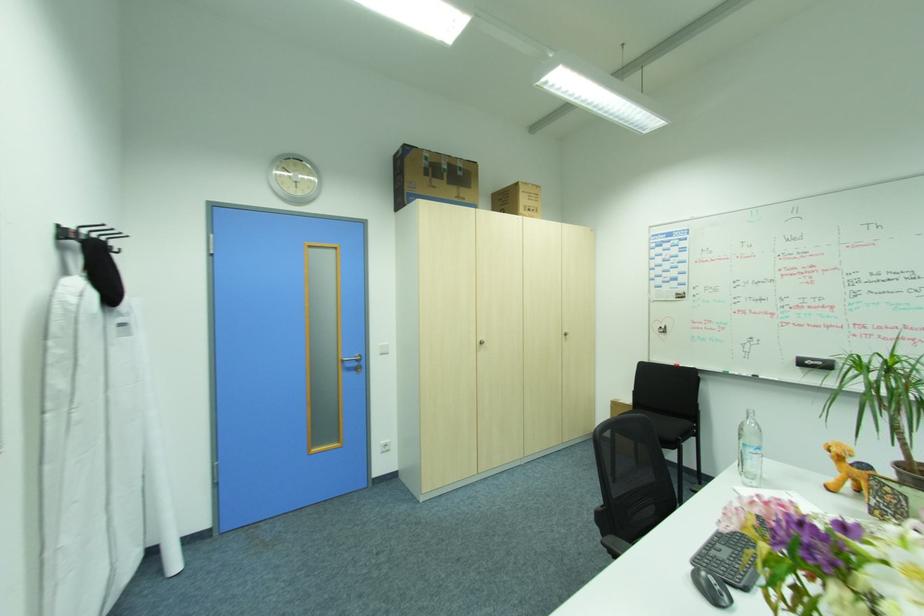
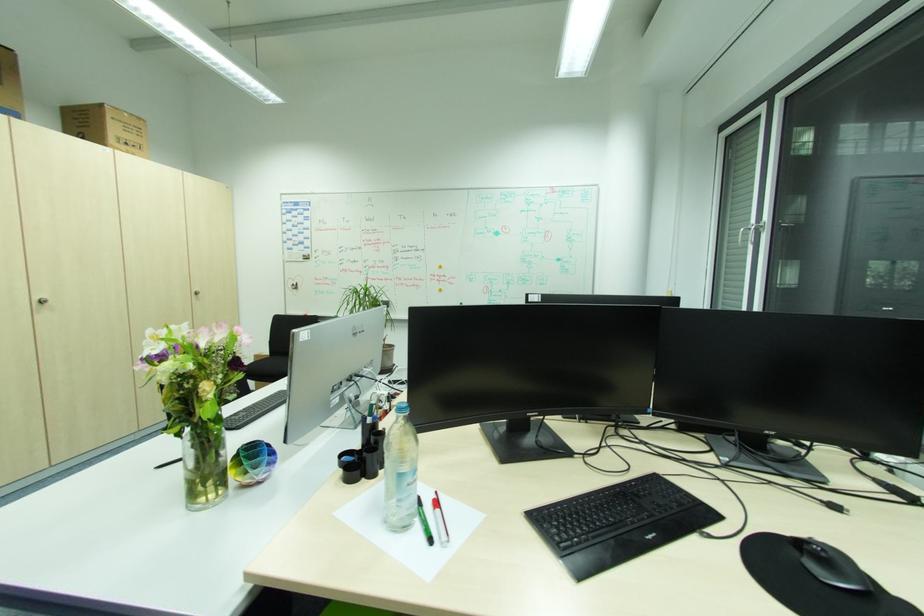
Locate, in the second image, the point that corresponds to (570,334) in the first image.

(202, 293)